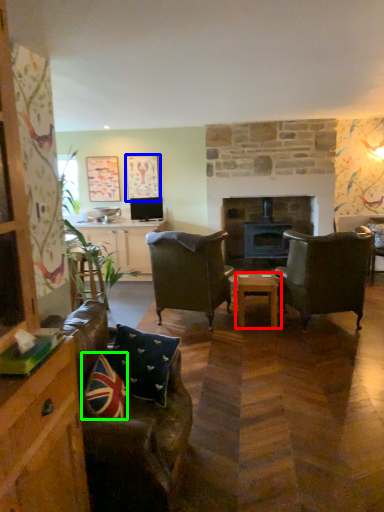
Question: Which is nearer to the table (highlighted by a red box)? picture frame (highlighted by a blue box) or pillow (highlighted by a green box).

Choices:
 (A) picture frame
 (B) pillow

Answer: (B)